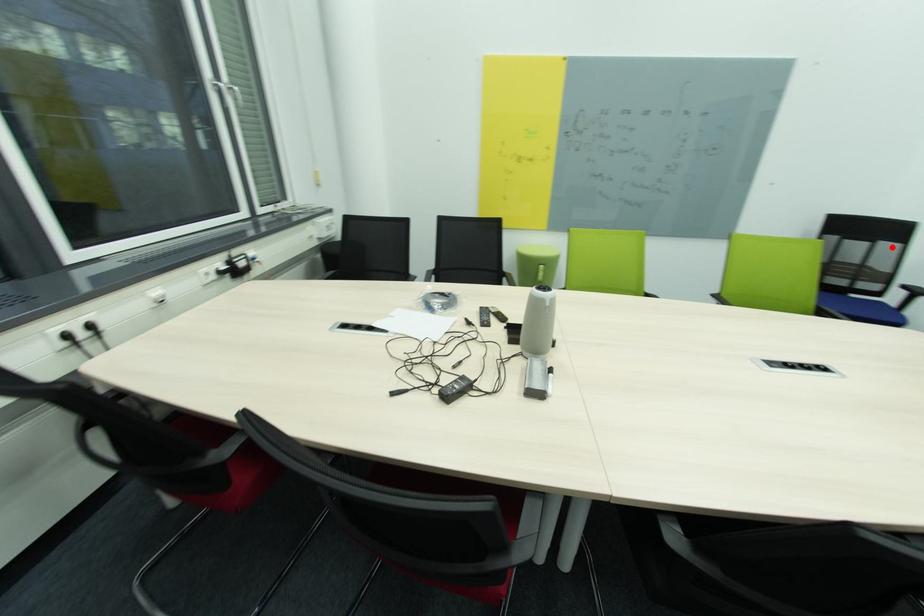
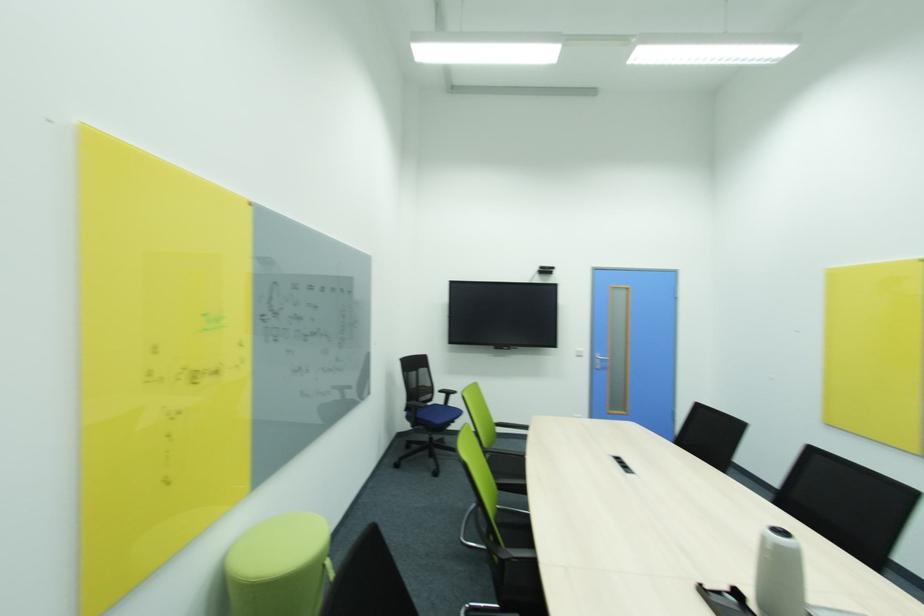
Question: I am providing you with two images of the same scene from different viewpoints. Image1 has a red point marked. In image2, the corresponding 3D location appears at what relative position? Reply with the corresponding letter.

Choices:
 (A) Closer
 (B) Farther

Answer: (A)